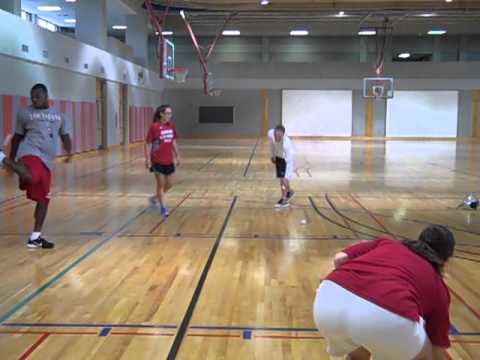
Where is `floor`? floor is located at coordinates (389, 176).